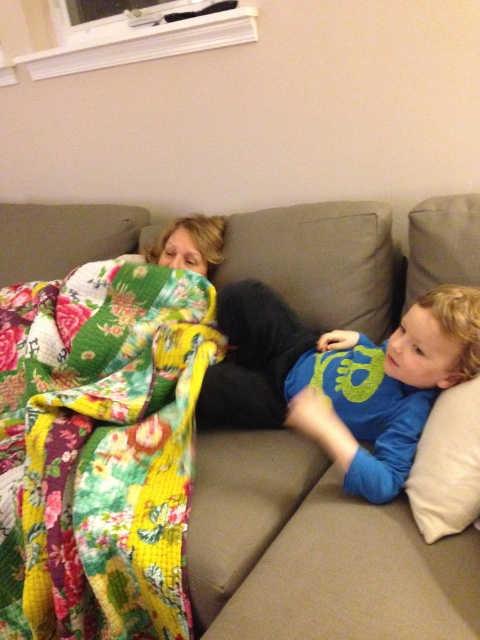
You are a photographer taking a photo of the two people on the gray sectional sofa. You want to focus on the floral patchwork quilt at left and the blue cotton shirt at right. Which object should you adjust your camera focus on first if you want to ensure both are in focus?

The floral patchwork quilt at left is closer to the viewer than the blue cotton shirt at right. To ensure both are in focus, you should focus on the floral patchwork quilt at left first, as it is closer, and the depth of field will naturally include the blue cotton shirt at right if focused properly.